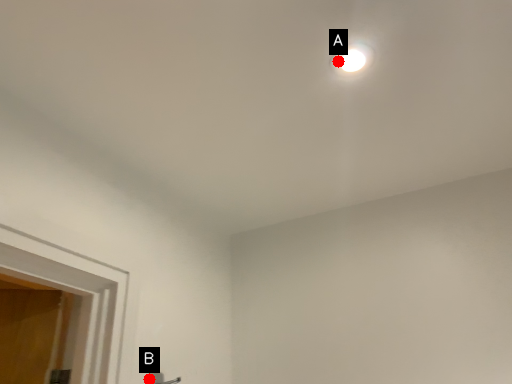
Question: Two points are circled on the image, labeled by A and B beside each circle. Which point is farther to the camera?

Choices:
 (A) A is further
 (B) B is further

Answer: (B)